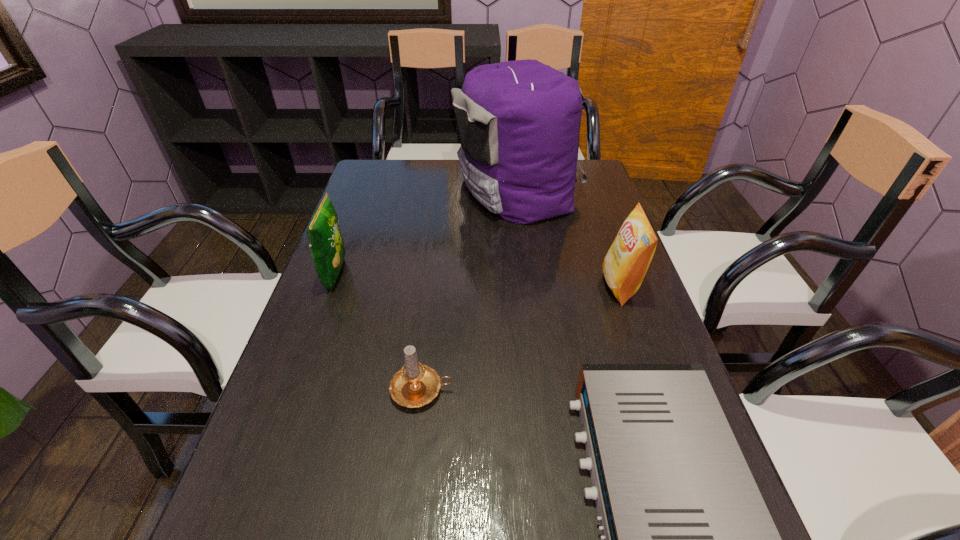
Where is `free space between the second shortest object and the backpack`? free space between the second shortest object and the backpack is located at coordinates (469, 290).

The width and height of the screenshot is (960, 540). Find the location of `free point between the farthest object and the candle`. free point between the farthest object and the candle is located at coordinates (469, 290).

The image size is (960, 540). Identify the location of unoccupied position between the right crisp (potato chip) and the tallest object. (568, 238).

The image size is (960, 540). In order to click on free space that is in between the right crisp (potato chip) and the candle in this screenshot , I will do `click(521, 338)`.

Where is `object that is the fourth closest to the second shortest object`? The height and width of the screenshot is (540, 960). object that is the fourth closest to the second shortest object is located at coordinates (518, 122).

Identify the location of object that is the closest to the right crisp (potato chip). (518, 122).

Identify the location of vacant region that satisfies the following two spatial constraints: 1. on the front-facing side of the candle; 2. on the left side of the left crisp (potato chip). (294, 390).

Identify the location of free location that satisfies the following two spatial constraints: 1. on the front-facing side of the left crisp (potato chip); 2. on the back side of the candle. (294, 390).